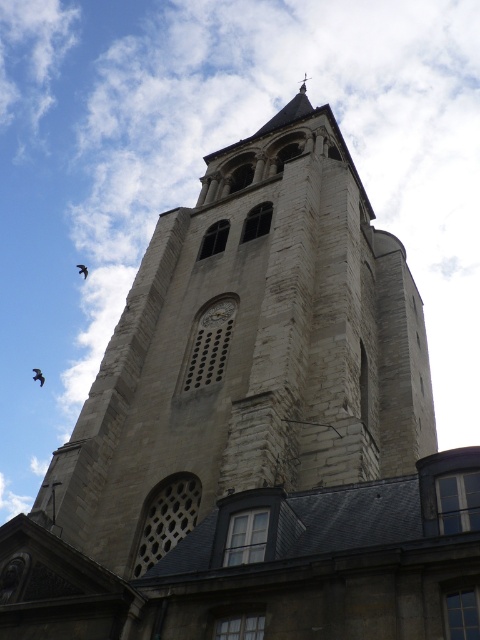
Question: Is black feathered bird at upper left below brown feathered bird at upper left?

Choices:
 (A) no
 (B) yes

Answer: (B)

Question: In this image, where is black feathered bird at upper left located relative to brown feathered bird at upper left?

Choices:
 (A) left
 (B) right

Answer: (A)

Question: Can you confirm if black feathered bird at upper left is positioned below brown feathered bird at upper left?

Choices:
 (A) no
 (B) yes

Answer: (B)

Question: Which point is farther to the camera?

Choices:
 (A) (40, 376)
 (B) (84, 273)

Answer: (A)